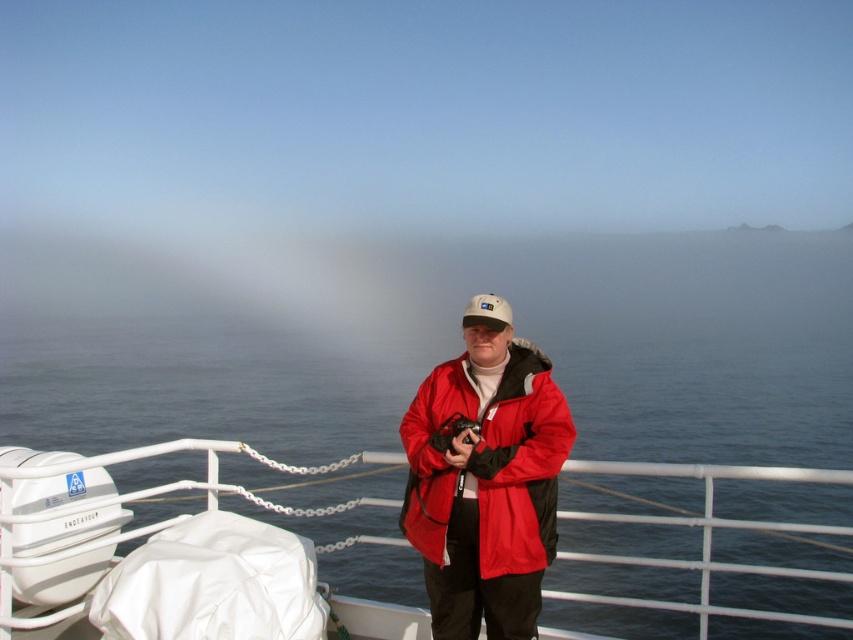
You are standing on the deck of a boat and want to take a photo of the red matte jacket at center. If your camera has a maximum focus range of 5 meters, will you be able to capture the jacket clearly?

The red matte jacket at center is 5.79 meters from the viewer. Since the camera can only focus up to 5 meters, it will not be able to capture the jacket clearly.

You are a photographer on the boat deck. You need to place a small flag between the two points, point [764,573] and point [467,323]. Which point should the flag be closer to so it appears larger in the photo?

To make the flag appear larger in the photo, place it closer to point [764,573] because it is closer to the camera than point [467,323].

You are a photographer on the boat deck. You need to adjust your camera focus to capture both the red matte jacket at center and the white fabric cap at center clearly. Which object should you focus on first to ensure proper depth of field?

The red matte jacket at center is much taller than the white fabric cap at center, so you should focus on the red matte jacket at center first to ensure both are in focus.